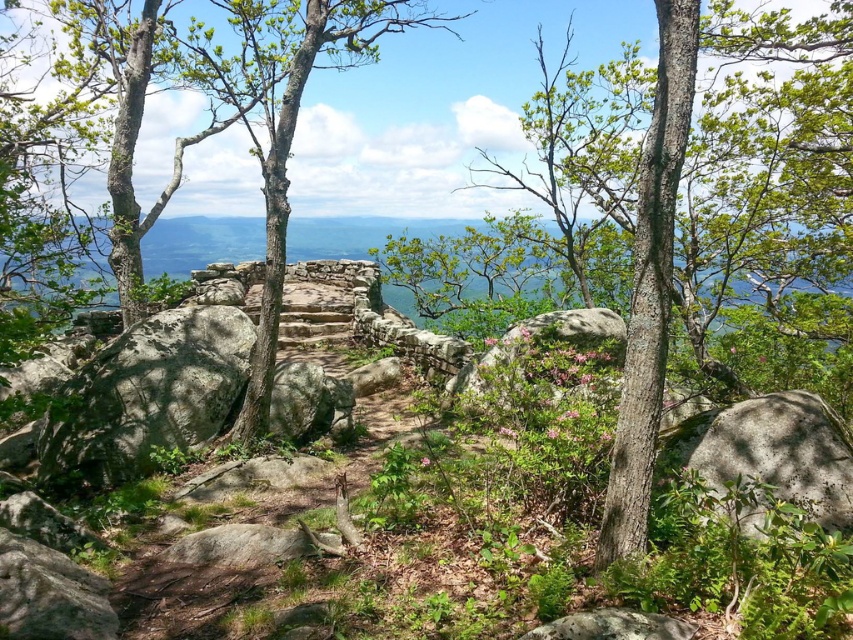
Looking at this image, is green rough bark tree at center taller than gray rough rock at left?

Correct, green rough bark tree at center is much taller as gray rough rock at left.

Is point (709, 29) farther from camera compared to point (164, 392)?

Yes, point (709, 29) is farther from viewer.

Between point (790, 257) and point (112, 385), which one is positioned behind?

Point (790, 257)

The height and width of the screenshot is (640, 853). What are the coordinates of `green rough bark tree at center` in the screenshot? It's located at (772, 205).

Find the location of a particular element. green rough bark tree at center is located at coordinates (772, 205).

What do you see at coordinates (772, 205) in the screenshot? The image size is (853, 640). I see `green rough bark tree at center` at bounding box center [772, 205].

Image resolution: width=853 pixels, height=640 pixels. In order to click on green rough bark tree at center in this screenshot , I will do click(772, 205).

How much distance is there between gray rough rock at left and gray rough rock at lower right?

They are 4.76 meters apart.

This screenshot has height=640, width=853. What do you see at coordinates (148, 394) in the screenshot?
I see `gray rough rock at left` at bounding box center [148, 394].

Is point (103, 440) positioned before point (747, 436)?

That is False.

Identify the location of gray rough rock at left. (148, 394).